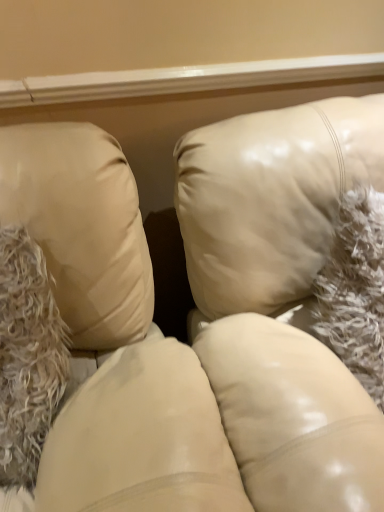
Image resolution: width=384 pixels, height=512 pixels. Describe the element at coordinates (28, 356) in the screenshot. I see `white fluffy fur at left` at that location.

Identify the location of white fluffy fur at left. (28, 356).

This screenshot has height=512, width=384. What are the coordinates of `white fluffy fur at left` in the screenshot? It's located at (28, 356).